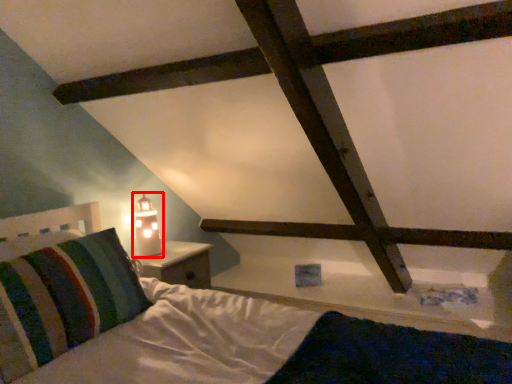
Question: Where is table lamp (annotated by the red box) located in relation to pillow in the image?

Choices:
 (A) right
 (B) left

Answer: (A)